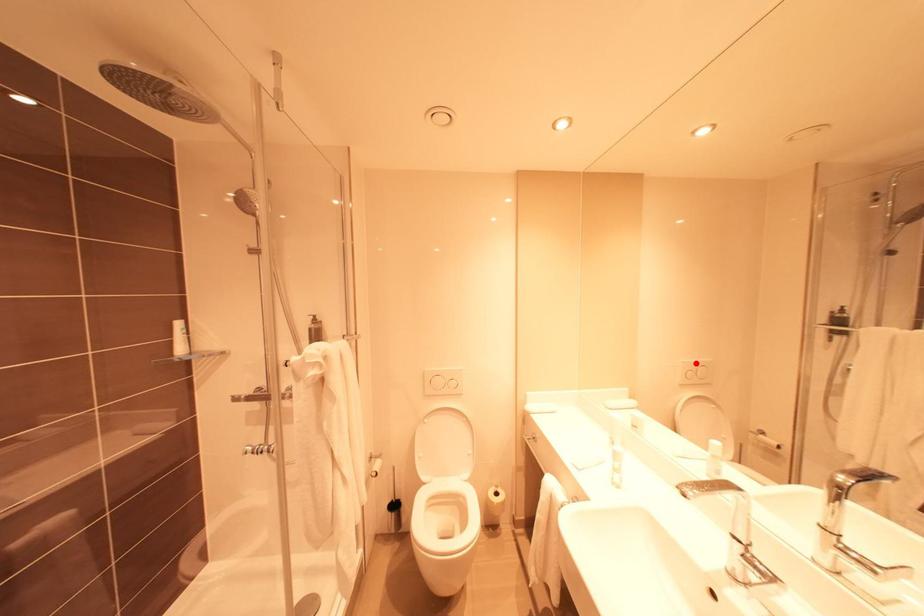
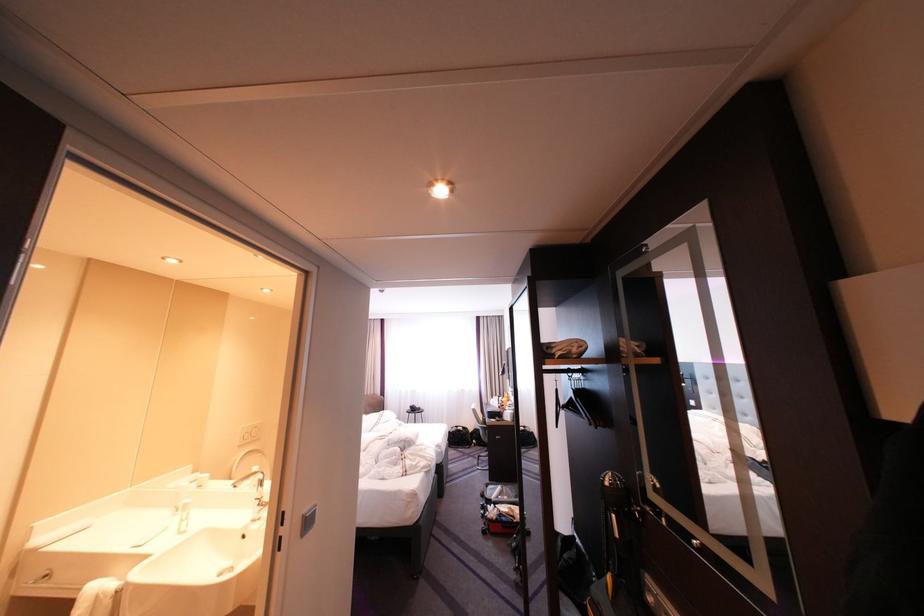
Question: I am providing you with two images of the same scene from different viewpoints. A red point is marked on the first image. Can you still see the location of the red point in image 2?

Choices:
 (A) Yes
 (B) No

Answer: (A)